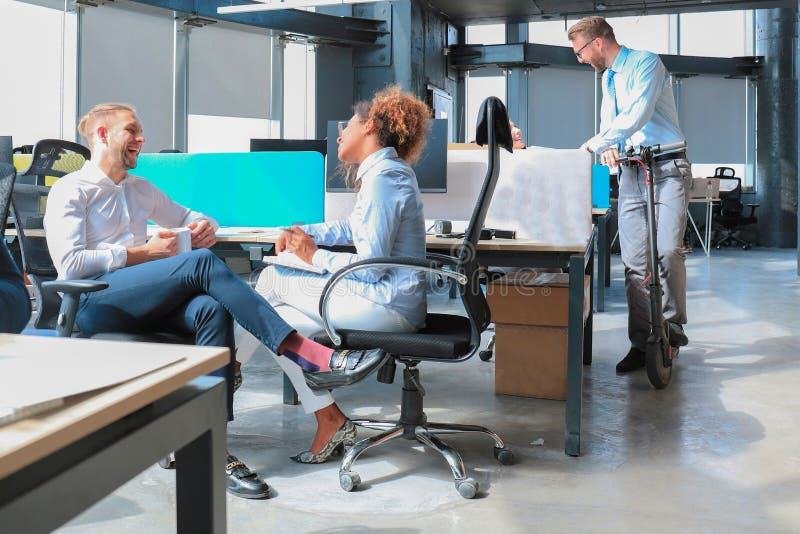
Identify the location of desk. This screenshot has height=534, width=800. (572, 299), (521, 245), (568, 439), (593, 230).